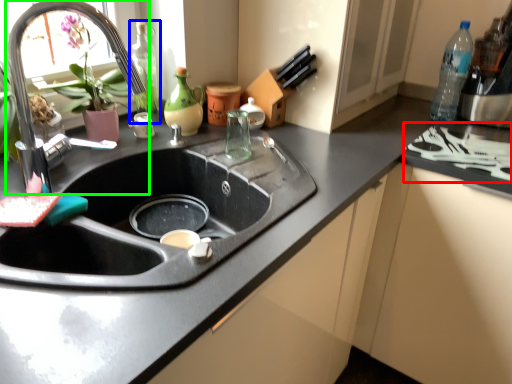
Question: Which object is the closest to the stove (highlighted by a red box)? Choose among these: bottle (highlighted by a blue box) or tap (highlighted by a green box).

Choices:
 (A) bottle
 (B) tap

Answer: (A)